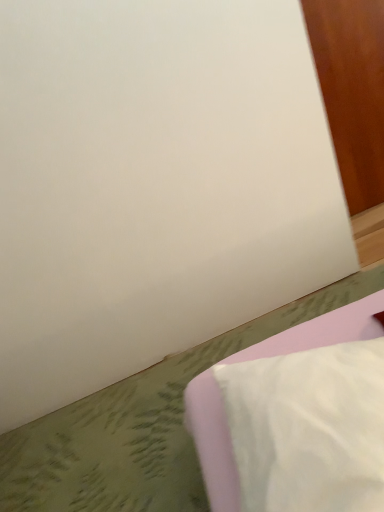
Locate an element on the screen. vacant point above white fabric pillow at lower right (from a real-world perspective) is located at coordinates (315, 401).